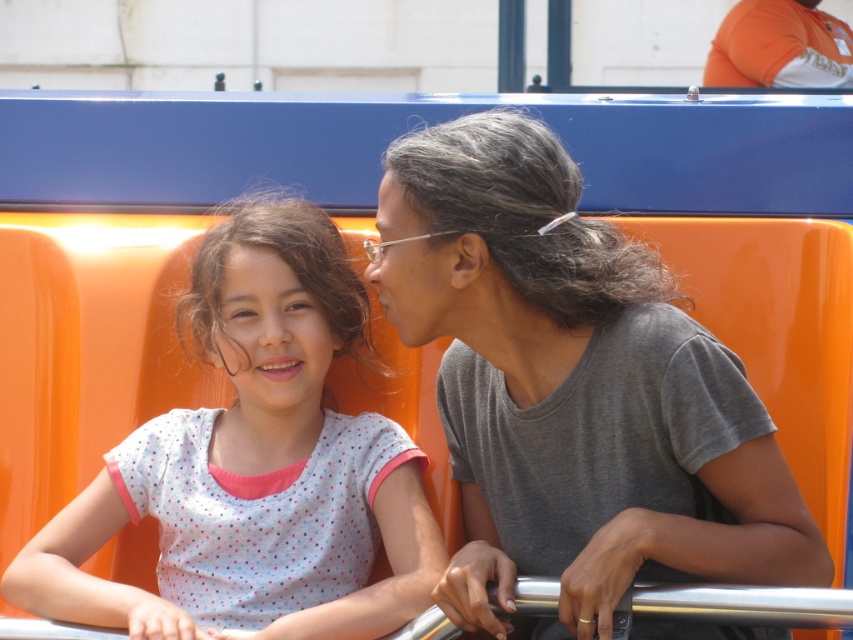
Question: Is gray matte hair at center positioned behind white dotted shirt at center?

Choices:
 (A) no
 (B) yes

Answer: (A)

Question: Which object appears closest to the camera in this image?

Choices:
 (A) white dotted shirt at center
 (B) gray matte hair at center

Answer: (B)

Question: Which point is closer to the camera?

Choices:
 (A) (318, 401)
 (B) (525, 259)

Answer: (B)

Question: Does gray matte hair at center appear on the right side of white dotted shirt at center?

Choices:
 (A) no
 (B) yes

Answer: (B)

Question: Can you confirm if gray matte hair at center is positioned to the left of white dotted shirt at center?

Choices:
 (A) yes
 (B) no

Answer: (B)